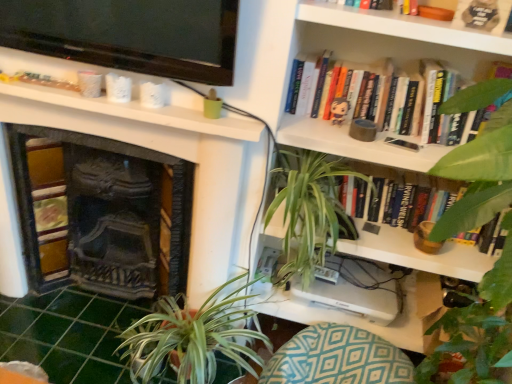
Where is `vacant space situated on the left part of matte plastic toy at upper center`? vacant space situated on the left part of matte plastic toy at upper center is located at coordinates (303, 116).